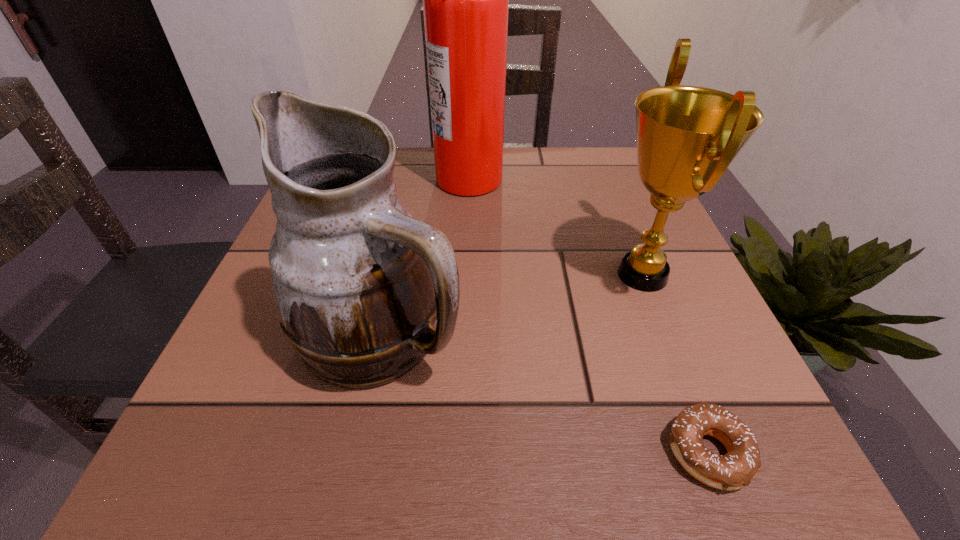
The image size is (960, 540). Find the location of `free space at the left edge`. free space at the left edge is located at coordinates (244, 376).

In the image, there is a desktop. At what (x,y) coordinates should I click in order to perform the action: click on vacant region at the right edge. Please return your answer as a coordinate pair (x, y). Looking at the image, I should click on (701, 289).

In the image, there is a desktop. Identify the location of vacant space at the far right corner. The height and width of the screenshot is (540, 960). (594, 192).

At what (x,y) coordinates should I click in order to perform the action: click on blank area at the near right corner. Please return your answer as a coordinate pair (x, y). Looking at the image, I should click on (658, 448).

What are the coordinates of `free space between the nearest object and the fire extinguisher` in the screenshot? It's located at (588, 315).

In order to click on vacant space that's between the award and the shortest object in this screenshot , I will do `click(675, 363)`.

Where is `free space between the tallest object and the award`? free space between the tallest object and the award is located at coordinates (556, 226).

Where is `vacant space in between the tallest object and the award`? vacant space in between the tallest object and the award is located at coordinates click(556, 226).

You are a GUI agent. You are given a task and a screenshot of the screen. Output one action in this format:
    pyautogui.click(x=<x>, y=<y>)
    Task: Click on the empty space between the pitcher and the shortest object
    
    Given the screenshot: What is the action you would take?
    pyautogui.click(x=544, y=394)

At what (x,y) coordinates should I click in order to perform the action: click on empty space between the nearest object and the award. Please return your answer as a coordinate pair (x, y). Looking at the image, I should click on (675, 363).